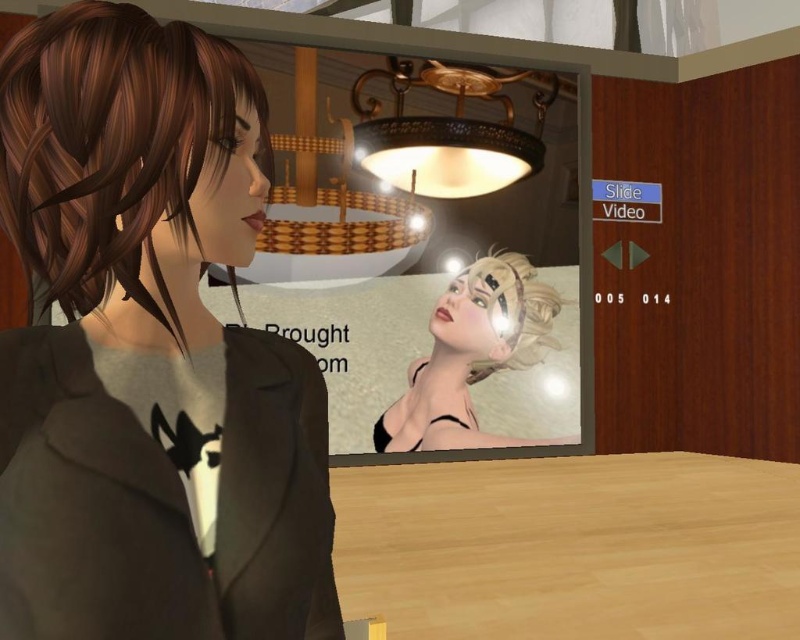
You are a stylist in a virtual environment. You need to determine which object is narrower between the shiny brown hair at left and the smooth beige headband at center. Which one is narrower?

The shiny brown hair at left is narrower than the smooth beige headband at center.

You are a character in the game and you want to pick up the matte gray hoodie at center. What are the coordinates where you should move to in order to grab it?

The coordinates to move to in order to grab the matte gray hoodie at center are point (150, 349).

You are a character in this virtual environment and want to reach the point at coordinates point (330, 525). If your maximum reach distance is 25 inches, can you reach it?

The distance of point (330, 525) from camera is 26.34 inches, so you cannot reach it since it is beyond your maximum reach distance of 25 inches.